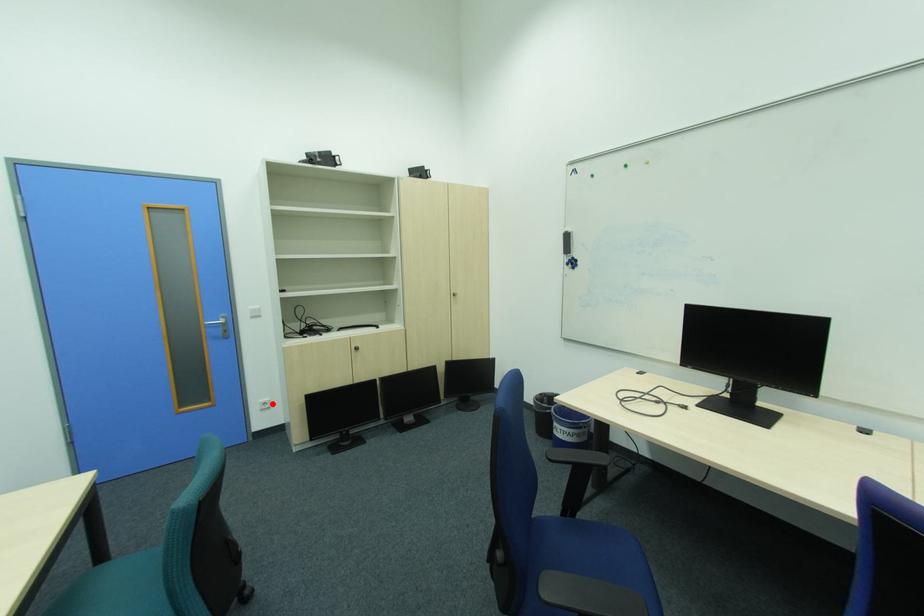
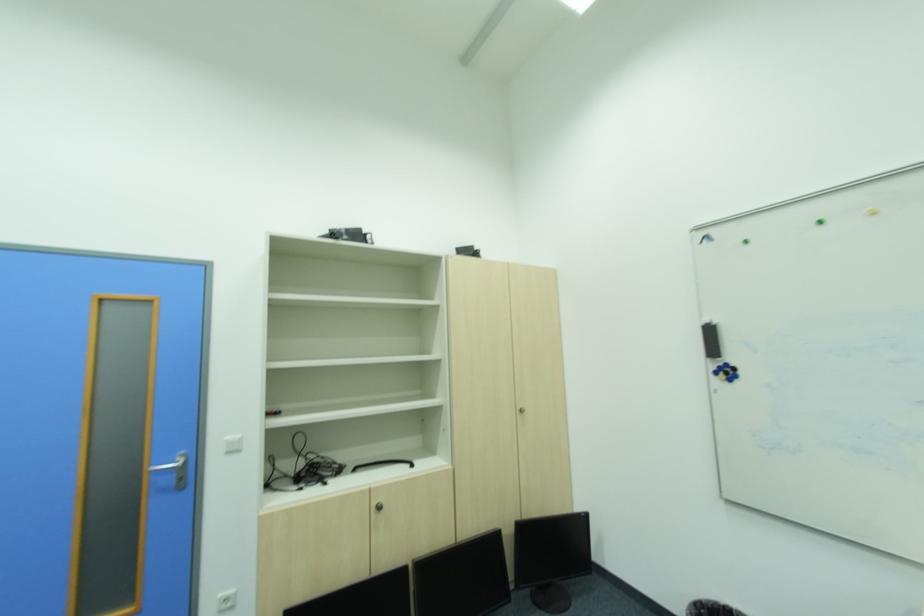
Question: I am providing you with two images of the same scene from different viewpoints. Given a red point in image1, look at the same physical point in image2. Is it:

Choices:
 (A) Closer to the viewpoint
 (B) Farther from the viewpoint

Answer: (A)